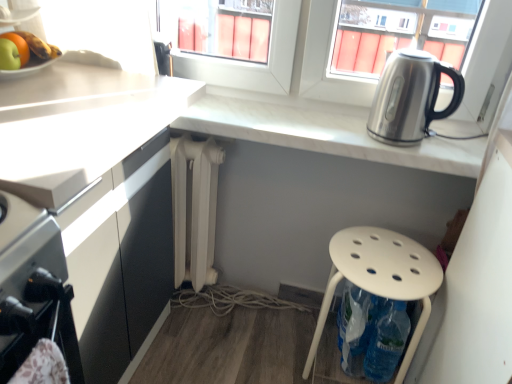
Describe the element at coordinates (320, 130) in the screenshot. The width and height of the screenshot is (512, 384). I see `white marble countertop at upper right, the 1th countertop in the right-to-left sequence` at that location.

This screenshot has height=384, width=512. What do you see at coordinates (381, 277) in the screenshot?
I see `white plastic stool at lower right` at bounding box center [381, 277].

What do you see at coordinates (195, 208) in the screenshot? I see `white matte radiator at center` at bounding box center [195, 208].

The height and width of the screenshot is (384, 512). In order to click on shiny metallic bowl at upper left in this screenshot , I will do `click(31, 47)`.

Can you confirm if white plastic stool at lower right is taller than stainless steel kettle at upper right?

Yes, white plastic stool at lower right is taller than stainless steel kettle at upper right.

Which is behind, point (359, 235) or point (387, 72)?

The point (359, 235) is behind.

Would you say white plastic stool at lower right is inside or outside stainless steel kettle at upper right?

The correct answer is: outside.

Does white plastic stool at lower right have a smaller size compared to stainless steel kettle at upper right?

Incorrect, white plastic stool at lower right is not smaller in size than stainless steel kettle at upper right.

Can you confirm if green matte apple at upper left is smaller than white plastic stool at lower right?

Indeed, green matte apple at upper left has a smaller size compared to white plastic stool at lower right.

In the image, is green matte apple at upper left positioned in front of or behind white plastic stool at lower right?

In the image, green matte apple at upper left appears in front of white plastic stool at lower right.

Considering the positions of point (6, 50) and point (331, 246), is point (6, 50) closer or farther from the camera than point (331, 246)?

Point (6, 50) is positioned closer to the camera compared to point (331, 246).

What's the angular difference between green matte apple at upper left and white plastic stool at lower right's facing directions?

91.6 degrees separate the facing orientations of green matte apple at upper left and white plastic stool at lower right.

Is white marble countertop at upper right, the 1th countertop in the right-to-left sequence, in front of or behind white matte countertop at left, which is the 1th countertop in left-to-right order, in the image?

white marble countertop at upper right, the 1th countertop in the right-to-left sequence, is positioned farther from the viewer than white matte countertop at left, which is the 1th countertop in left-to-right order.

Can you confirm if white marble countertop at upper right, the 1th countertop in the right-to-left sequence, is positioned to the right of white matte countertop at left, the 2th countertop when ordered from right to left?

Yes, white marble countertop at upper right, the 1th countertop in the right-to-left sequence, is to the right of white matte countertop at left, the 2th countertop when ordered from right to left.

Based on the photo, which object is thinner, white marble countertop at upper right, the 1th countertop in the right-to-left sequence, or white matte countertop at left, the 2th countertop when ordered from right to left?

white marble countertop at upper right, the 1th countertop in the right-to-left sequence.

Would you consider white marble countertop at upper right, the 1th countertop in the right-to-left sequence, to be distant from white matte countertop at left, which is the 1th countertop in left-to-right order?

white marble countertop at upper right, the 1th countertop in the right-to-left sequence, is near white matte countertop at left, which is the 1th countertop in left-to-right order, not far away.

In the scene shown: Can you confirm if white matte radiator at center is taller than white matte countertop at left, which is the 1th countertop in left-to-right order?

No, white matte radiator at center is not taller than white matte countertop at left, which is the 1th countertop in left-to-right order.

From the image's perspective, does white matte radiator at center appear lower than white matte countertop at left, the 2th countertop when ordered from right to left?

No, from the image's perspective, white matte radiator at center is not below white matte countertop at left, the 2th countertop when ordered from right to left.

Which is correct: white matte radiator at center is inside white matte countertop at left, which is the 1th countertop in left-to-right order, or outside of it?

white matte radiator at center exists outside the volume of white matte countertop at left, which is the 1th countertop in left-to-right order.

Looking at this image, can you confirm if white matte radiator at center is thinner than white matte countertop at left, which is the 1th countertop in left-to-right order?

Yes, white matte radiator at center is thinner than white matte countertop at left, which is the 1th countertop in left-to-right order.

From a real-world perspective, is white matte countertop at left, the 2th countertop when ordered from right to left, physically located above or below white plastic stool at lower right?

white matte countertop at left, the 2th countertop when ordered from right to left, is above white plastic stool at lower right.

Could you tell me if white matte countertop at left, the 2th countertop when ordered from right to left, is facing white plastic stool at lower right?

Yes, white matte countertop at left, the 2th countertop when ordered from right to left, is turned towards white plastic stool at lower right.

How distant is white matte countertop at left, which is the 1th countertop in left-to-right order, from white plastic stool at lower right?

A distance of 26.11 inches exists between white matte countertop at left, which is the 1th countertop in left-to-right order, and white plastic stool at lower right.

Between white matte countertop at left, the 2th countertop when ordered from right to left, and white plastic stool at lower right, which one has less height?

white plastic stool at lower right is shorter.

Based on the photo, from a real-world perspective, who is located lower, white marble countertop at upper right, the 1th countertop in the right-to-left sequence, or shiny metallic bowl at upper left?

white marble countertop at upper right, the 1th countertop in the right-to-left sequence.

Does point (256, 96) come closer to viewer compared to point (20, 38)?

No, (256, 96) is further to viewer.

Are white marble countertop at upper right, marked as the 2th countertop in a left-to-right arrangement, and shiny metallic bowl at upper left located far from each other?

They are positioned close to each other.

Considering the sizes of objects white marble countertop at upper right, marked as the 2th countertop in a left-to-right arrangement, and shiny metallic bowl at upper left in the image provided, who is wider, white marble countertop at upper right, marked as the 2th countertop in a left-to-right arrangement, or shiny metallic bowl at upper left?

With larger width is white marble countertop at upper right, marked as the 2th countertop in a left-to-right arrangement.

Considering the relative positions of white marble countertop at upper right, marked as the 2th countertop in a left-to-right arrangement, and stainless steel kettle at upper right in the image provided, is white marble countertop at upper right, marked as the 2th countertop in a left-to-right arrangement, to the right of stainless steel kettle at upper right from the viewer's perspective?

No, white marble countertop at upper right, marked as the 2th countertop in a left-to-right arrangement, is not to the right of stainless steel kettle at upper right.

From the image's perspective, between white marble countertop at upper right, the 1th countertop in the right-to-left sequence, and stainless steel kettle at upper right, which one is located above?

From the image's view, stainless steel kettle at upper right is above.

Considering the sizes of objects white marble countertop at upper right, the 1th countertop in the right-to-left sequence, and stainless steel kettle at upper right in the image provided, who is taller, white marble countertop at upper right, the 1th countertop in the right-to-left sequence, or stainless steel kettle at upper right?

stainless steel kettle at upper right.

The image size is (512, 384). Identify the location of stool that appears on the left of stainless steel kettle at upper right. (381, 277).

Locate an element on the screen. The height and width of the screenshot is (384, 512). apple located in front of the white plastic stool at lower right is located at coordinates (9, 55).

Which object lies nearer to the anchor point shiny metallic bowl at upper left, white matte radiator at center or white marble countertop at upper right, the 1th countertop in the right-to-left sequence?

white matte radiator at center lies closer to shiny metallic bowl at upper left than the other object.

Based on their spatial positions, is white marble countertop at upper right, marked as the 2th countertop in a left-to-right arrangement, or white matte radiator at center closer to white plastic stool at lower right?

white marble countertop at upper right, marked as the 2th countertop in a left-to-right arrangement.

When comparing their distances from white marble countertop at upper right, the 1th countertop in the right-to-left sequence, does white matte radiator at center or stainless steel kettle at upper right seem closer?

Among the two, stainless steel kettle at upper right is located nearer to white marble countertop at upper right, the 1th countertop in the right-to-left sequence.

Considering their positions, is white matte countertop at left, which is the 1th countertop in left-to-right order, positioned closer to shiny metallic bowl at upper left than stainless steel kettle at upper right?

white matte countertop at left, which is the 1th countertop in left-to-right order, is positioned closer to the anchor shiny metallic bowl at upper left.

Looking at the image, which one is located further to white matte countertop at left, the 2th countertop when ordered from right to left, white marble countertop at upper right, marked as the 2th countertop in a left-to-right arrangement, or white matte radiator at center?

Based on the image, white marble countertop at upper right, marked as the 2th countertop in a left-to-right arrangement, appears to be further to white matte countertop at left, the 2th countertop when ordered from right to left.

From the image, which object appears to be farther from white matte radiator at center, green matte apple at upper left or white marble countertop at upper right, the 1th countertop in the right-to-left sequence?

Based on the image, green matte apple at upper left appears to be further to white matte radiator at center.

Estimate the real-world distances between objects in this image. Which object is further from white matte countertop at left, the 2th countertop when ordered from right to left, white marble countertop at upper right, the 1th countertop in the right-to-left sequence, or shiny metallic bowl at upper left?

shiny metallic bowl at upper left lies further to white matte countertop at left, the 2th countertop when ordered from right to left, than the other object.

Estimate the real-world distances between objects in this image. Which object is closer to white matte radiator at center, green matte apple at upper left or white matte countertop at left, which is the 1th countertop in left-to-right order?

white matte countertop at left, which is the 1th countertop in left-to-right order, is closer to white matte radiator at center.

Locate an element on the screen. apple between shiny metallic bowl at upper left and white matte radiator at center in the vertical direction is located at coordinates (9, 55).

Where is `radiator situated between green matte apple at upper left and stainless steel kettle at upper right from left to right`? The image size is (512, 384). radiator situated between green matte apple at upper left and stainless steel kettle at upper right from left to right is located at coordinates (195, 208).

The image size is (512, 384). Identify the location of radiator between white matte countertop at left, which is the 1th countertop in left-to-right order, and stainless steel kettle at upper right. (195, 208).

Locate an element on the screen. radiator between shiny metallic bowl at upper left and white plastic stool at lower right from left to right is located at coordinates (195, 208).